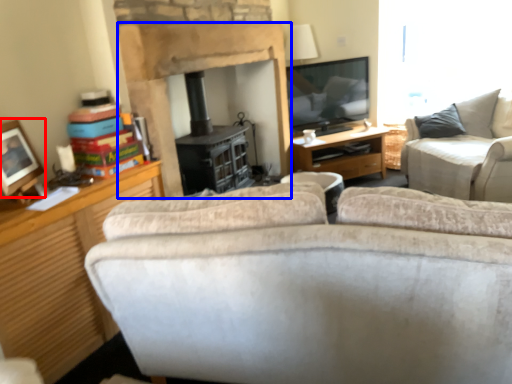
Question: Which object appears closest to the camera in this image, picture frame (highlighted by a red box) or fireplace (highlighted by a blue box)?

Choices:
 (A) picture frame
 (B) fireplace

Answer: (A)